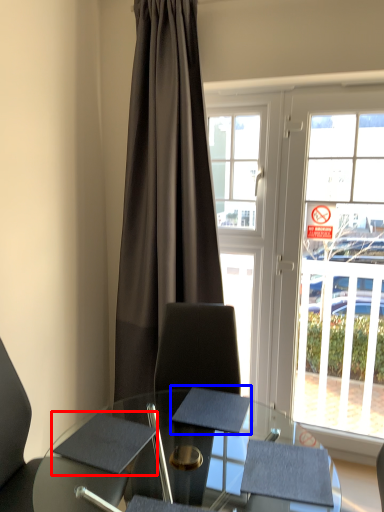
Question: Which point is further to the camera, notepad (highlighted by a red box) or notepad (highlighted by a blue box)?

Choices:
 (A) notepad
 (B) notepad

Answer: (B)